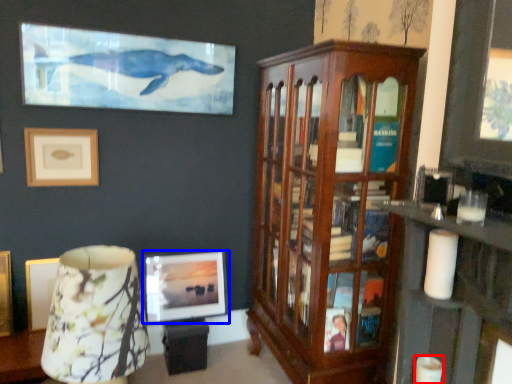
Question: Which point is further to the camera, candle (highlighted by a red box) or picture frame (highlighted by a blue box)?

Choices:
 (A) candle
 (B) picture frame

Answer: (B)